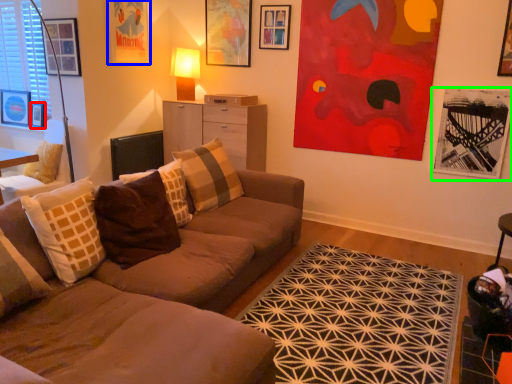
Question: Estimate the real-world distances between objects in this image. Which object is farther from picture frame (highlighted by a red box), picture frame (highlighted by a blue box) or picture frame (highlighted by a green box)?

Choices:
 (A) picture frame
 (B) picture frame

Answer: (B)